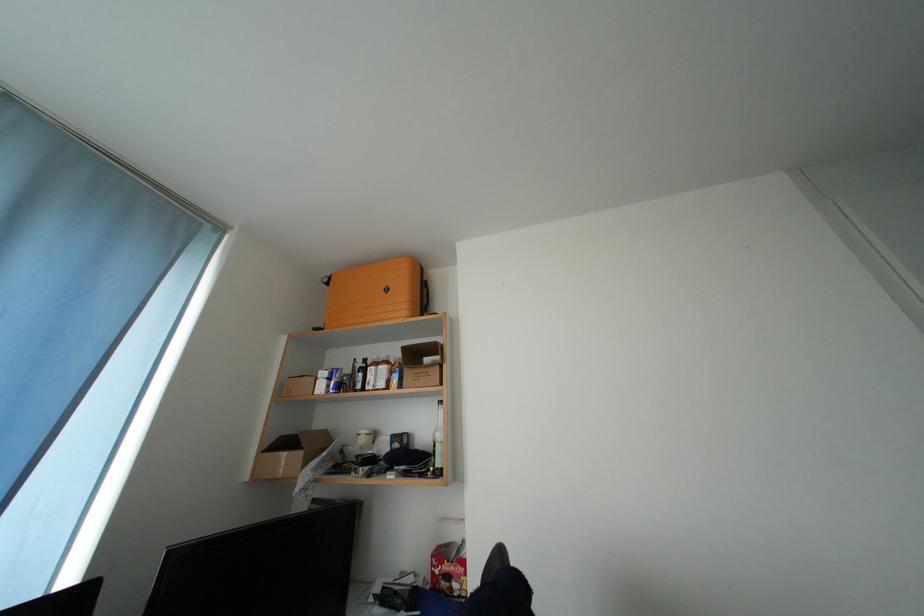
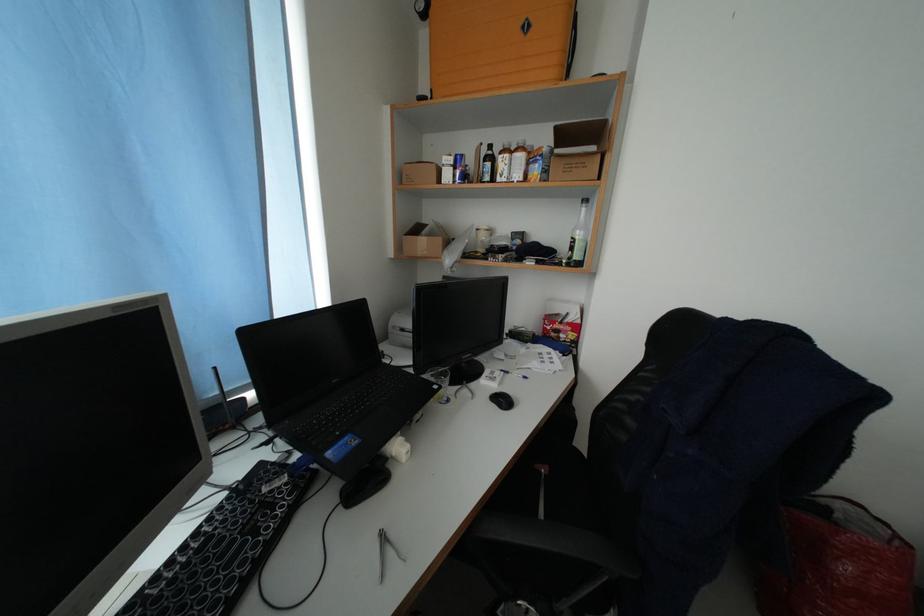
The point at (381, 373) is marked in the first image. Where is the corresponding point in the second image?

(515, 161)